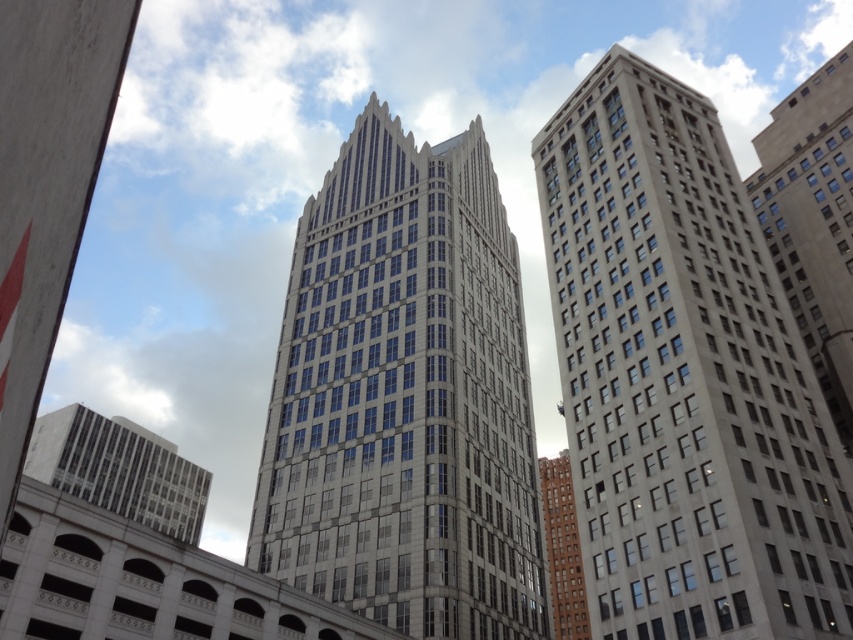
Is the position of gray stone skyscraper at center more distant than that of gray concrete building at right?

Yes, it is behind gray concrete building at right.

Who is positioned more to the right, gray stone skyscraper at center or gray concrete building at right?

Positioned to the right is gray concrete building at right.

Find the location of a particular element. This screenshot has width=853, height=640. gray stone skyscraper at center is located at coordinates (404, 397).

Between point (792, 369) and point (61, 467), which one is positioned in front?

Positioned in front is point (792, 369).

Is point (724, 486) more distant than point (204, 497)?

No, it is not.

You are a GUI agent. You are given a task and a screenshot of the screen. Output one action in this format:
    pyautogui.click(x=<x>, y=<y>)
    Task: Click on the gray stone building at right
    Image resolution: width=853 pixels, height=640 pixels.
    Given the screenshot: What is the action you would take?
    pyautogui.click(x=683, y=378)

Identify the location of gray stone building at right. This screenshot has width=853, height=640. (683, 378).

Describe the element at coordinates (683, 378) in the screenshot. I see `gray stone building at right` at that location.

Does gray stone building at right have a lesser height compared to gray concrete building at right?

Incorrect, gray stone building at right's height does not fall short of gray concrete building at right's.

Where is `gray stone building at right`? gray stone building at right is located at coordinates (683, 378).